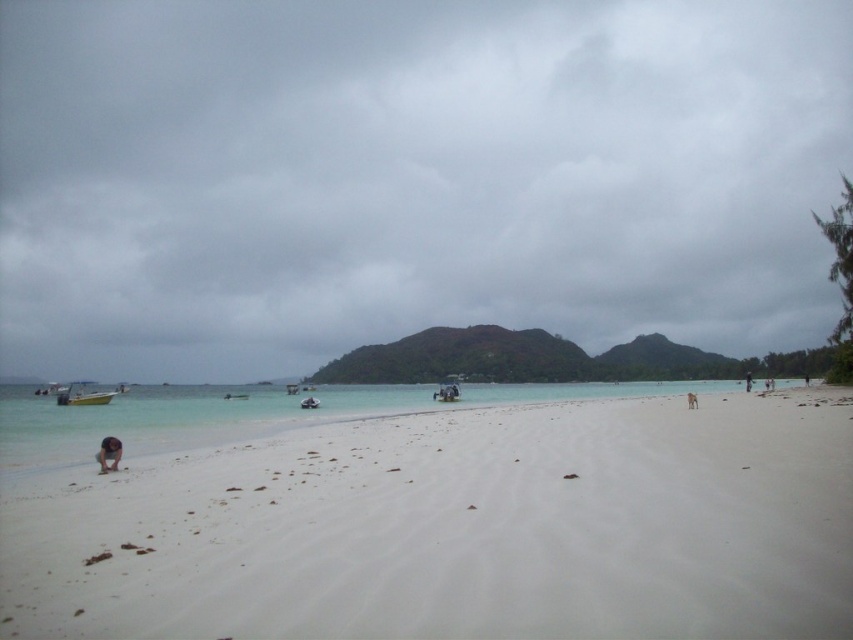
Which of these two, clear blue water at center or brown sand at lower center, stands taller?

clear blue water at center is taller.

Does point (206, 408) come behind point (689, 403)?

That is True.

Image resolution: width=853 pixels, height=640 pixels. I want to click on clear blue water at center, so click(x=254, y=413).

Between white sandy beach at lower left and brown sand at lower center, which one is positioned higher?

brown sand at lower center is higher up.

Does white sandy beach at lower left appear under brown sand at lower center?

Correct, white sandy beach at lower left is located below brown sand at lower center.

Image resolution: width=853 pixels, height=640 pixels. Identify the location of white sandy beach at lower left. (431, 513).

In order to click on white sandy beach at lower left in this screenshot , I will do `click(431, 513)`.

Which is in front, point (120, 442) or point (746, 385)?

Point (120, 442) is in front.

Does point (117, 464) lie behind point (746, 387)?

No, it is in front of (746, 387).

This screenshot has height=640, width=853. I want to click on light brown skin at lower left, so click(x=108, y=452).